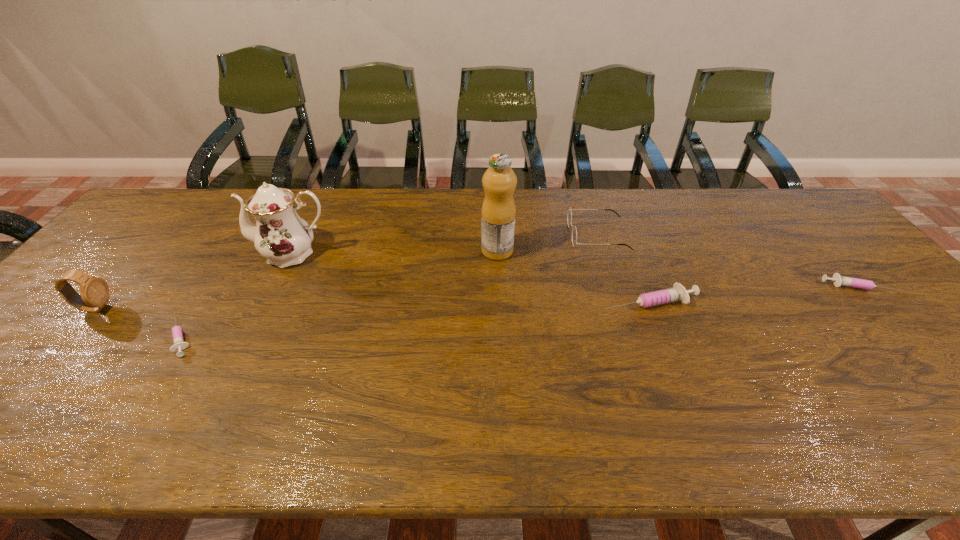
Locate an element on the screen. the leftmost syringe is located at coordinates (178, 342).

Find the location of a particular element. The width and height of the screenshot is (960, 540). the second object from left to right is located at coordinates (178, 342).

What are the coordinates of `the tallest syringe` in the screenshot? It's located at (678, 293).

Identify the location of the fifth tallest object. (678, 293).

The height and width of the screenshot is (540, 960). In order to click on the rightmost syringe in this screenshot , I will do `click(838, 280)`.

Where is `the second tallest syringe`? The width and height of the screenshot is (960, 540). the second tallest syringe is located at coordinates (838, 280).

The width and height of the screenshot is (960, 540). I want to click on chinaware, so click(280, 235).

Where is `the sixth shortest object`? This screenshot has width=960, height=540. the sixth shortest object is located at coordinates (280, 235).

Locate an element on the screen. The image size is (960, 540). spectacles is located at coordinates (569, 215).

Find the location of a particular element. the leftmost object is located at coordinates tap(94, 291).